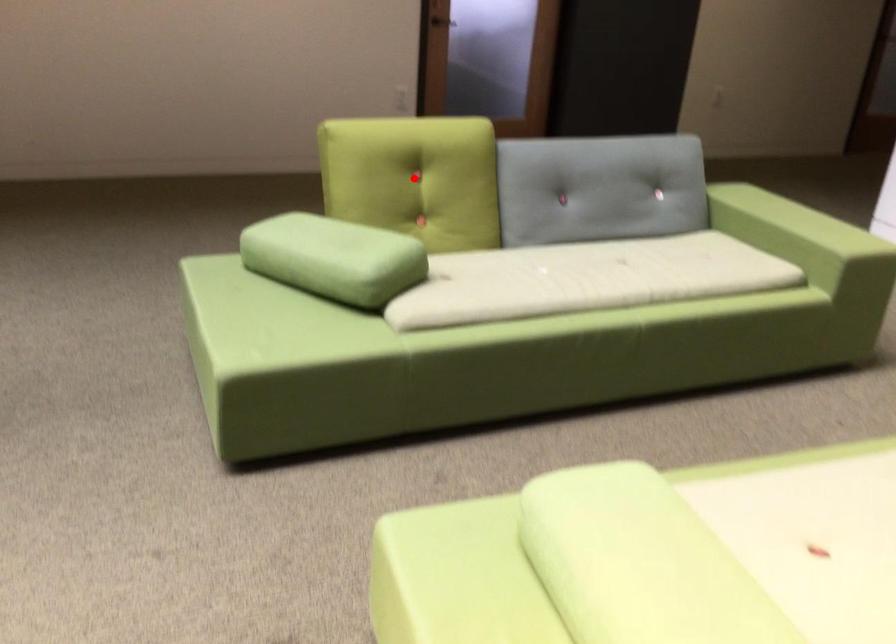
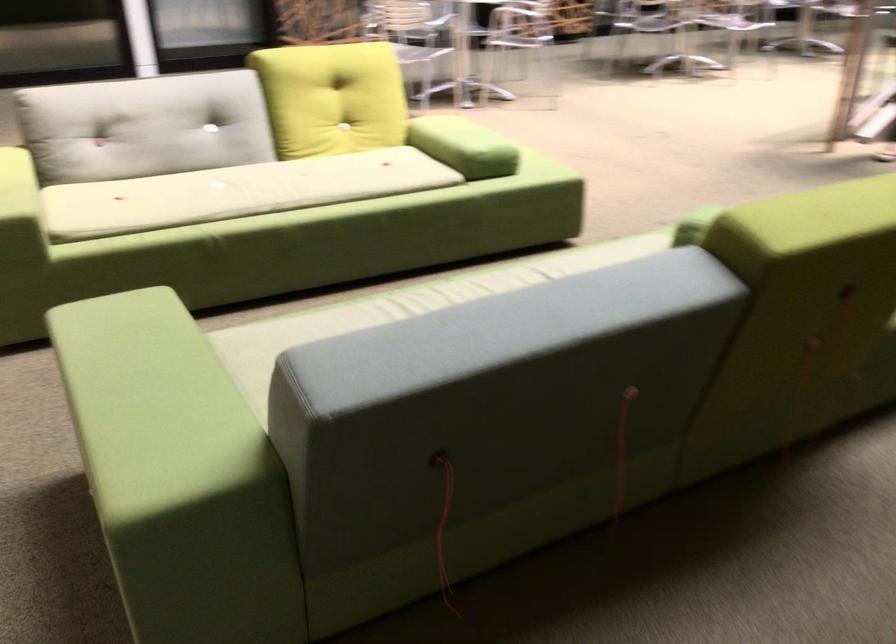
Question: I am providing you with two images of the same scene from different viewpoints. A red point is marked on the first image. Can you still see the location of the red point in image 2?

Choices:
 (A) Yes
 (B) No

Answer: (B)